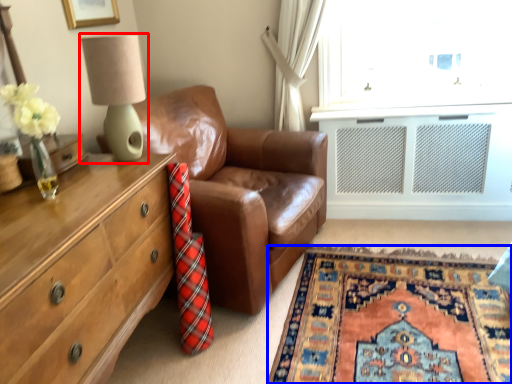
Question: Which point is further to the camera, table lamp (highlighted by a red box) or plain (highlighted by a blue box)?

Choices:
 (A) table lamp
 (B) plain

Answer: (A)